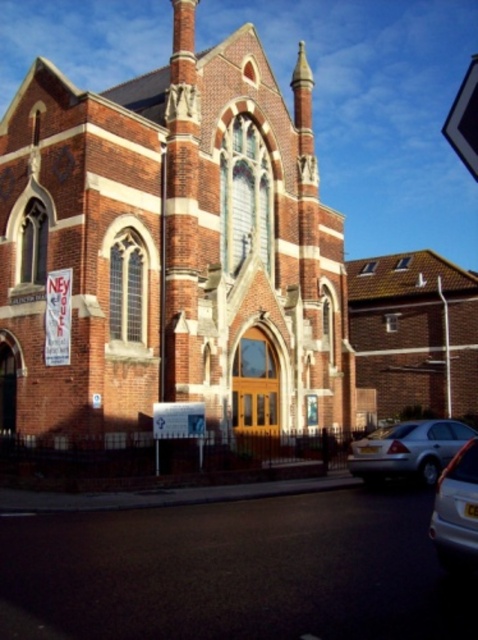
Is brick church at center bigger than silver metallic sedan at lower right?

Indeed, brick church at center has a larger size compared to silver metallic sedan at lower right.

You are a GUI agent. You are given a task and a screenshot of the screen. Output one action in this format:
    pyautogui.click(x=<x>, y=<y>)
    Task: Click on the brick church at center
    Image resolution: width=478 pixels, height=640 pixels.
    Given the screenshot: What is the action you would take?
    pyautogui.click(x=171, y=256)

I want to click on brick church at center, so point(171,256).

Who is positioned more to the left, silver metallic sedan at lower right or metallic silver car at lower right?

metallic silver car at lower right

Who is taller, silver metallic sedan at lower right or metallic silver car at lower right?

Standing taller between the two is metallic silver car at lower right.

Image resolution: width=478 pixels, height=640 pixels. I want to click on silver metallic sedan at lower right, so click(408, 451).

Locate an element on the screen. The height and width of the screenshot is (640, 478). silver metallic sedan at lower right is located at coordinates (408, 451).

Is brick church at center positioned at the back of metallic silver car at lower right?

Yes, it is.

Does brick church at center have a larger size compared to metallic silver car at lower right?

Yes.

You are a GUI agent. You are given a task and a screenshot of the screen. Output one action in this format:
    pyautogui.click(x=<x>, y=<y>)
    Task: Click on the brick church at center
    Image resolution: width=478 pixels, height=640 pixels.
    Given the screenshot: What is the action you would take?
    pyautogui.click(x=171, y=256)

This screenshot has height=640, width=478. I want to click on brick church at center, so click(171, 256).